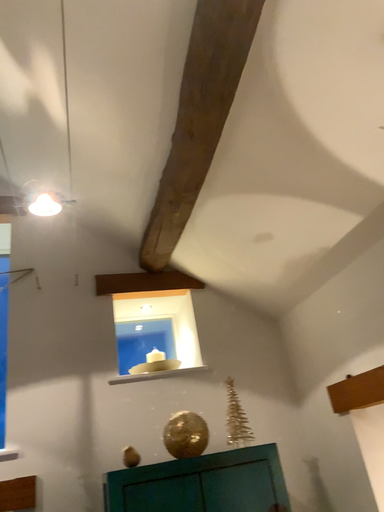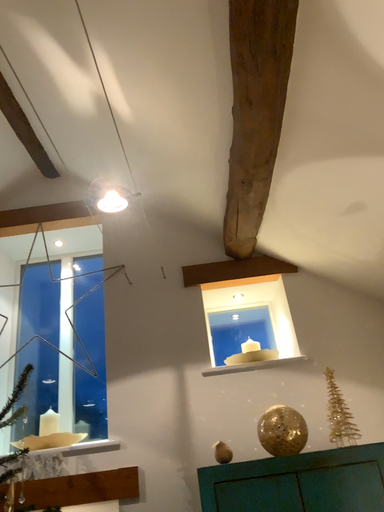
Question: How did the camera likely rotate when shooting the video?

Choices:
 (A) rotated left
 (B) rotated right

Answer: (A)